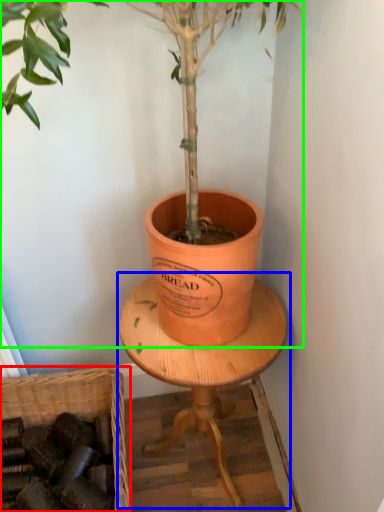
Question: Estimate the real-world distances between objects in this image. Which object is closer to basket (highlighted by a red box), round table (highlighted by a blue box) or houseplant (highlighted by a green box)?

Choices:
 (A) round table
 (B) houseplant

Answer: (A)